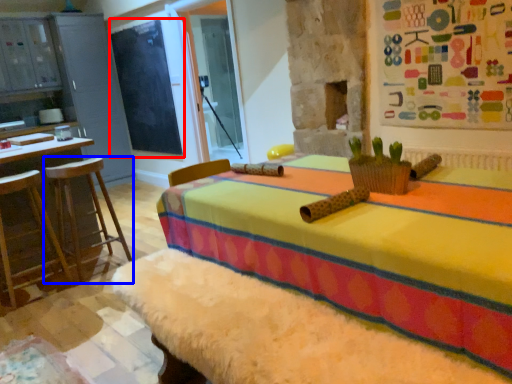
Question: Among these objects, which one is farthest to the camera, bulletin board (highlighted by a red box) or furniture (highlighted by a blue box)?

Choices:
 (A) bulletin board
 (B) furniture

Answer: (A)